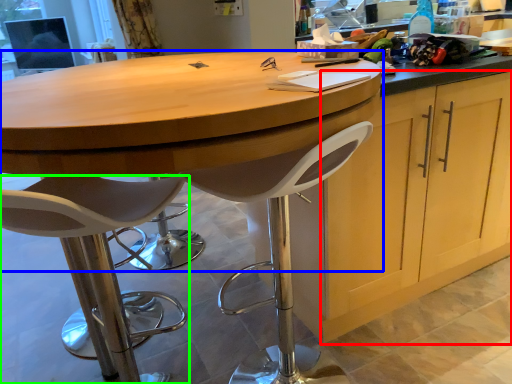
Question: Estimate the real-world distances between objects in this image. Which object is closer to cabinetry (highlighted by a red box), table (highlighted by a blue box) or chair (highlighted by a green box)?

Choices:
 (A) table
 (B) chair

Answer: (A)